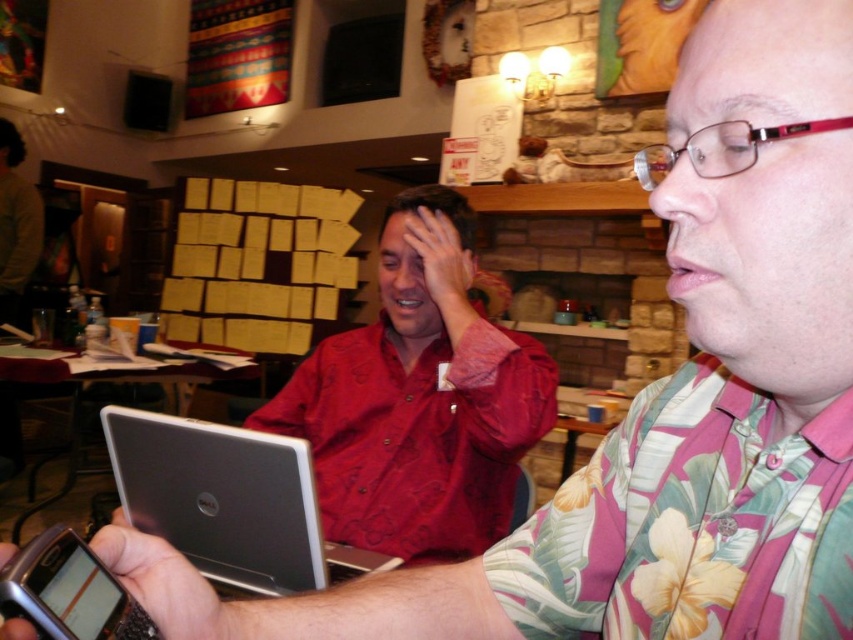
You are standing at the point marked by the coordinates point (448,465) in a room. You want to move to the exit door located at the far end of the room. Considering your height is 5 feet 8 inches, will you be able to see over the back of the sofa placed between you and the door? The sofa is 3 feet tall.

The point (448,465) and viewer are 4.41 feet apart from each other. Since the sofa is 3 feet tall and you are 5 feet 8 inches tall, you should be able to see over the back of the sofa as your height exceeds the sofa height.

You are a customer in the cafe and want to point out a specific spot on the pink floral shirt at right. The coordinates given are point (x=692, y=524). Can you confirm if this point is located on the pink floral shirt at right?

Yes, the point (x=692, y=524) is located on the pink floral shirt at right.

You are a photographer trying to capture a candid shot of the scene. The pink floral shirt at right and the silver metallic laptop at center are both in your viewfinder. Given their sizes, which object should you focus on to ensure it appears larger in your photo?

The silver metallic laptop at center should be focused on to appear larger in the photo since it is larger in size compared to the pink floral shirt at right.